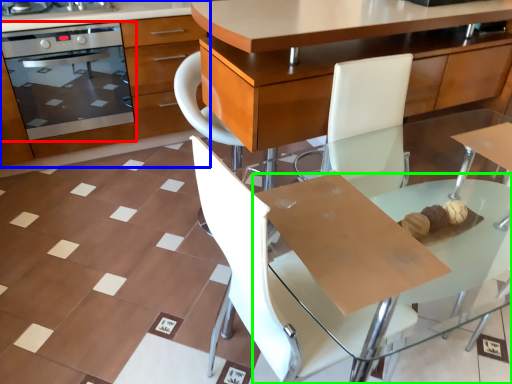
Question: Which is farther away from kitchen appliance (highlighted by a red box)? cabinetry (highlighted by a blue box) or round table (highlighted by a green box)?

Choices:
 (A) cabinetry
 (B) round table

Answer: (B)